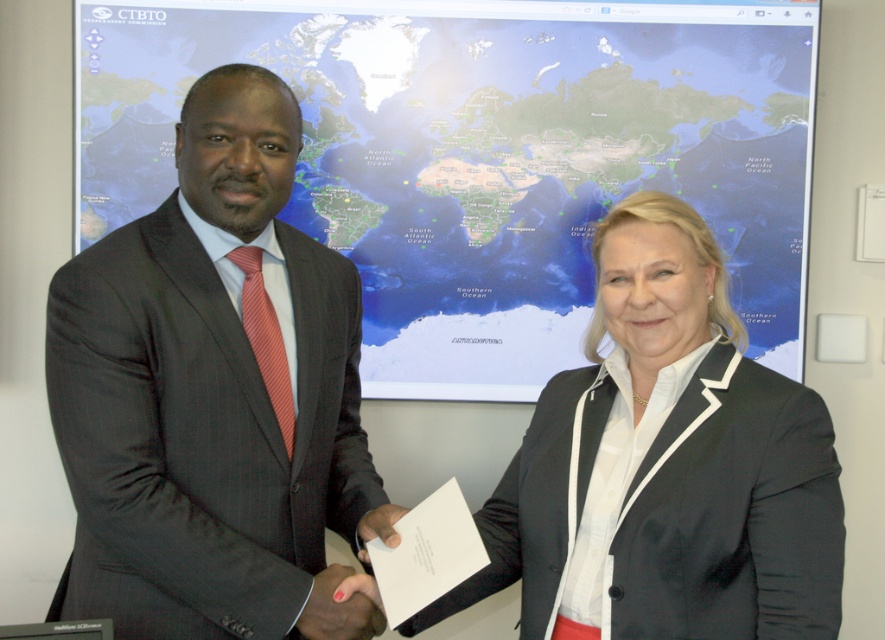
Looking at the scene, where is the matte world map at center in relation to the dark gray suit at left?

The matte world map at center is to the right of the dark gray suit at left.

You are an event organizer planning a photo shoot for a professional event. You need to ensure that the matte black blazer at center and the matte black hand at center are both visible in the final image. Given their sizes, which object should you prioritize positioning closer to the camera to maintain clarity?

The matte black blazer at center is larger than the matte black hand at center, so you should prioritize positioning the matte black hand at center closer to the camera to ensure both objects are clearly visible in the photo.

You are an event planner organizing a networking event. You need to arrange seating so that the matte black blazer at center and the matte black hand at center are visible to all attendees. Given their heights, which object should be placed closer to the front of the stage?

The matte black hand at center should be placed closer to the front of the stage because it is shorter than the matte black blazer at center, ensuring both are visible to all attendees.